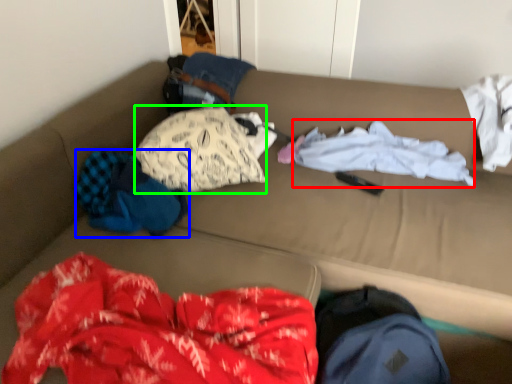
Question: Which object is the farthest from clothing (highlighted by a red box)? Choose among these: clothing (highlighted by a blue box) or clothing (highlighted by a green box).

Choices:
 (A) clothing
 (B) clothing

Answer: (A)